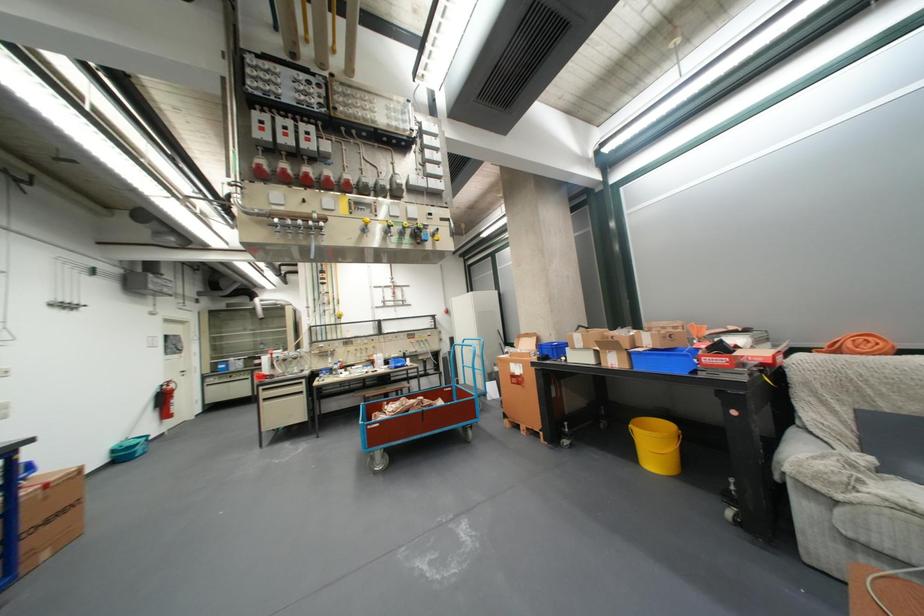
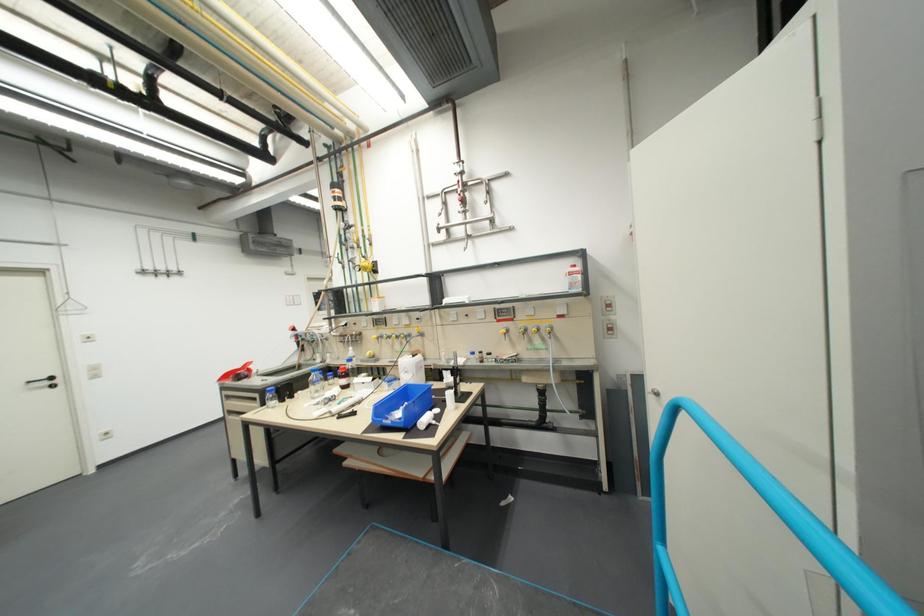
Where in the second image is the point corresponding to pixel 315 381 from the first image?

(269, 397)